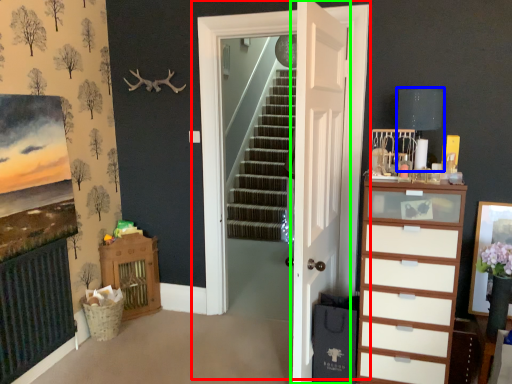
Question: Which object is positioned closest to door (highlighted by a red box)? Select from lamp (highlighted by a blue box) and door (highlighted by a green box).

Choices:
 (A) lamp
 (B) door

Answer: (B)